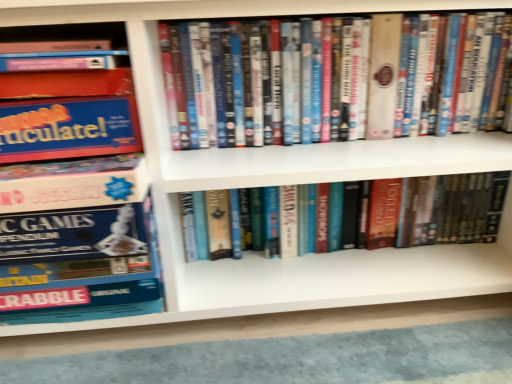
Question: Is blue cardboard game box at left, which is counted as the third book, starting from the right, turned away from matte plastic dvds at center, placed as the 2th book when sorted from left to right?

Choices:
 (A) yes
 (B) no

Answer: (B)

Question: Is blue cardboard game box at left, which is counted as the third book, starting from the right, in front of matte plastic dvds at center, placed as the 2th book when sorted from left to right?

Choices:
 (A) yes
 (B) no

Answer: (A)

Question: Can you confirm if blue cardboard game box at left, the first book from the left, is wider than matte plastic dvds at center, marked as the second book in a right-to-left arrangement?

Choices:
 (A) yes
 (B) no

Answer: (A)

Question: Is blue cardboard game box at left, which is counted as the third book, starting from the right, further to the viewer compared to matte plastic dvds at center, marked as the second book in a right-to-left arrangement?

Choices:
 (A) yes
 (B) no

Answer: (B)

Question: Considering the relative sizes of blue cardboard game box at left, the first book from the left, and matte plastic dvds at center, placed as the 2th book when sorted from left to right, in the image provided, is blue cardboard game box at left, the first book from the left, taller than matte plastic dvds at center, placed as the 2th book when sorted from left to right,?

Choices:
 (A) yes
 (B) no

Answer: (A)

Question: Does blue cardboard game box at left, which is counted as the third book, starting from the right, have a lesser height compared to matte plastic dvds at center, placed as the 2th book when sorted from left to right?

Choices:
 (A) no
 (B) yes

Answer: (A)

Question: Is hardcover book at center, the third book viewed from the left, not within blue cardboard game box at left, the first book from the left?

Choices:
 (A) yes
 (B) no

Answer: (A)

Question: Is the depth of hardcover book at center, the third book viewed from the left, less than that of blue cardboard game box at left, the first book from the left?

Choices:
 (A) yes
 (B) no

Answer: (B)

Question: Is hardcover book at center, the third book viewed from the left, not close to blue cardboard game box at left, which is counted as the third book, starting from the right?

Choices:
 (A) yes
 (B) no

Answer: (B)

Question: Can you confirm if hardcover book at center, which is the first book in right-to-left order, is bigger than blue cardboard game box at left, which is counted as the third book, starting from the right?

Choices:
 (A) yes
 (B) no

Answer: (B)

Question: Is hardcover book at center, which is the first book in right-to-left order, smaller than blue cardboard game box at left, which is counted as the third book, starting from the right?

Choices:
 (A) yes
 (B) no

Answer: (A)

Question: Does hardcover book at center, the third book viewed from the left, contain blue cardboard game box at left, the first book from the left?

Choices:
 (A) no
 (B) yes

Answer: (A)

Question: Is the depth of matte plastic dvds at center, marked as the second book in a right-to-left arrangement, greater than that of blue cardboard game box at left, which is counted as the third book, starting from the right?

Choices:
 (A) yes
 (B) no

Answer: (A)